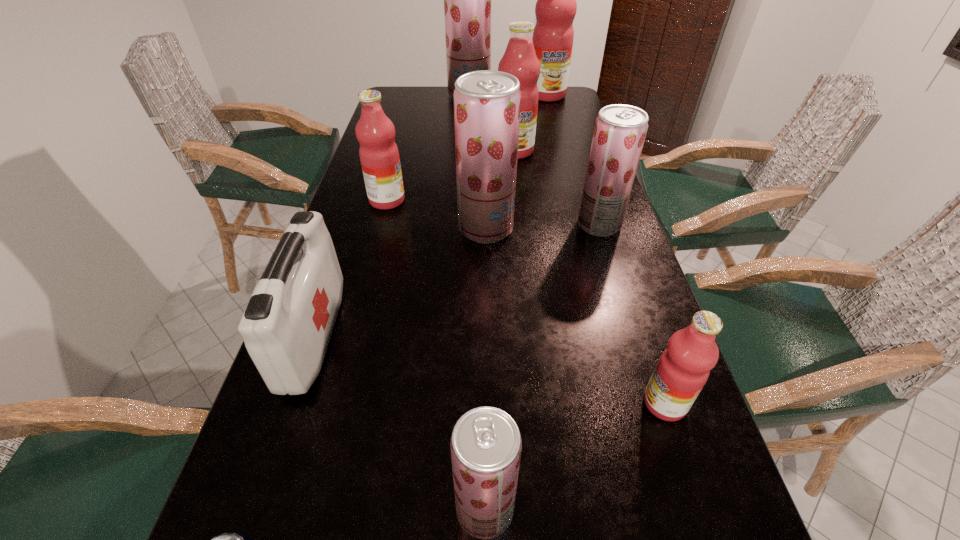
Locate an element on the screen. The width and height of the screenshot is (960, 540). the biggest strawberry fruit juice is located at coordinates click(x=467, y=0).

Identify the location of the farthest pink fruit juice. This screenshot has width=960, height=540. (556, 7).

Where is `the third smallest strawberry fruit juice`? the third smallest strawberry fruit juice is located at coordinates (487, 103).

Identify the location of the eighth nearest object. (520, 60).

The height and width of the screenshot is (540, 960). I want to click on the sixth nearest fruit juice, so click(520, 60).

You are a GUI agent. You are given a task and a screenshot of the screen. Output one action in this format:
    pyautogui.click(x=<x>, y=<y>)
    Task: Click on the rightmost strawberry fruit juice
    The image size is (960, 540).
    Given the screenshot: What is the action you would take?
    pyautogui.click(x=620, y=130)

The width and height of the screenshot is (960, 540). What are the coordinates of `the fifth nearest fruit juice` in the screenshot? It's located at coord(379,156).

Where is `the leftmost pink fruit juice`? the leftmost pink fruit juice is located at coordinates pyautogui.click(x=379, y=156).

You are a GUI agent. You are given a task and a screenshot of the screen. Output one action in this format:
    pyautogui.click(x=<x>, y=<y>)
    Task: Click on the seventh farthest fruit juice
    
    Given the screenshot: What is the action you would take?
    pyautogui.click(x=683, y=369)

At what (x,y) coordinates should I click in order to perform the action: click on the nearest pink fruit juice. Please return your answer as a coordinate pair (x, y). The height and width of the screenshot is (540, 960). Looking at the image, I should click on (683, 369).